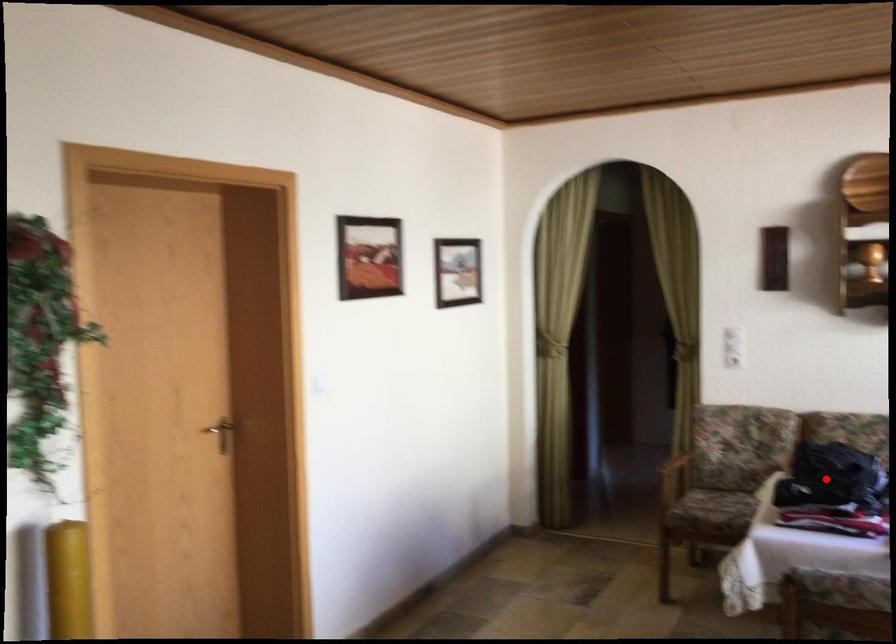
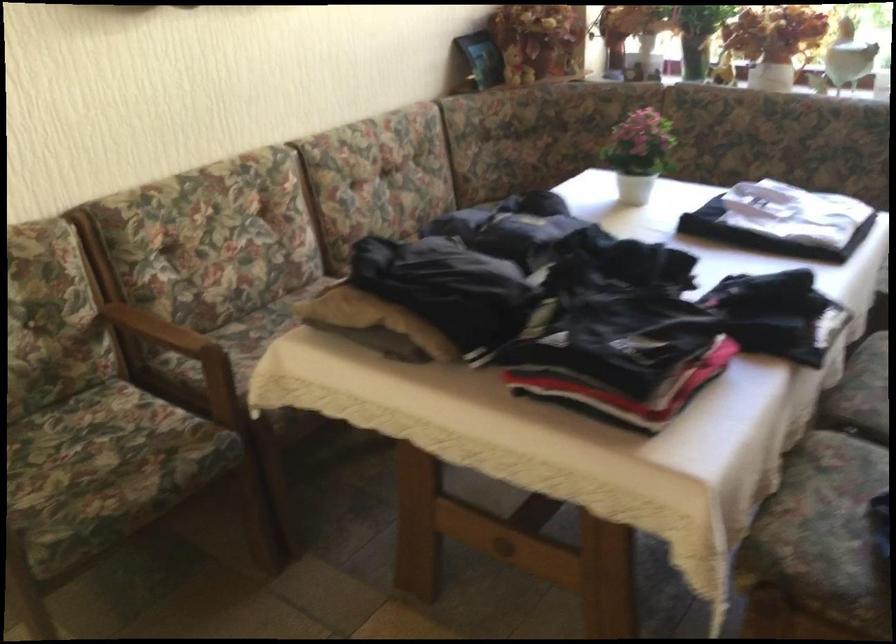
Question: I am providing you with two images of the same scene from different viewpoints. In image1, a red point is highlighted. Considering the same 3D point in image2, which of the following is correct?

Choices:
 (A) It is closer
 (B) It is farther

Answer: (A)